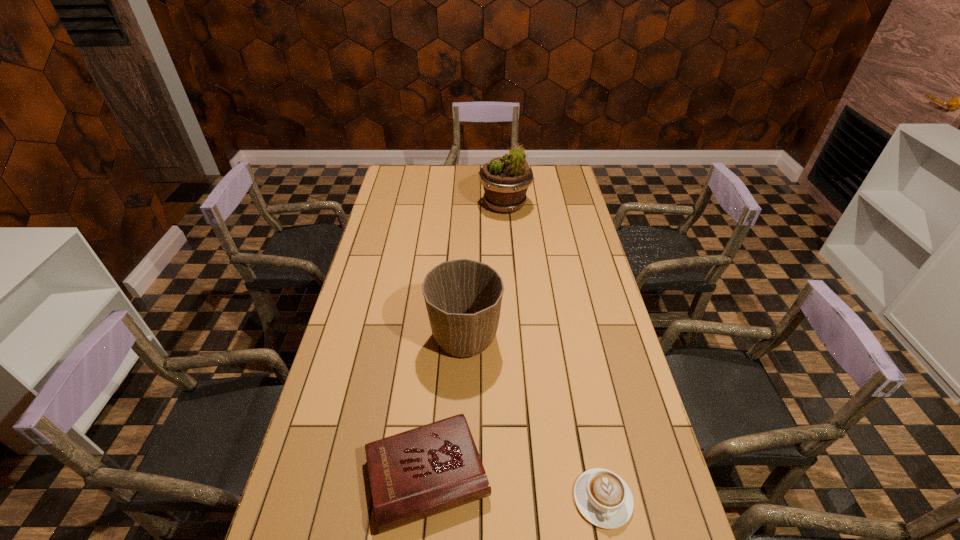
Choose which object is the second nearest neighbor to the hardback book. Please provide its 2D coordinates. Your answer should be formatted as a tuple, i.e. [(x, y)], where the tuple contains the x and y coordinates of a point satisfying the conditions above.

[(603, 498)]

Identify which object is the second nearest to the cappuccino. Please provide its 2D coordinates. Your answer should be formatted as a tuple, i.e. [(x, y)], where the tuple contains the x and y coordinates of a point satisfying the conditions above.

[(463, 297)]

Locate an element on the screen. vacant region that satisfies the following two spatial constraints: 1. on the back side of the tallest object; 2. on the left side of the hardback book is located at coordinates (451, 205).